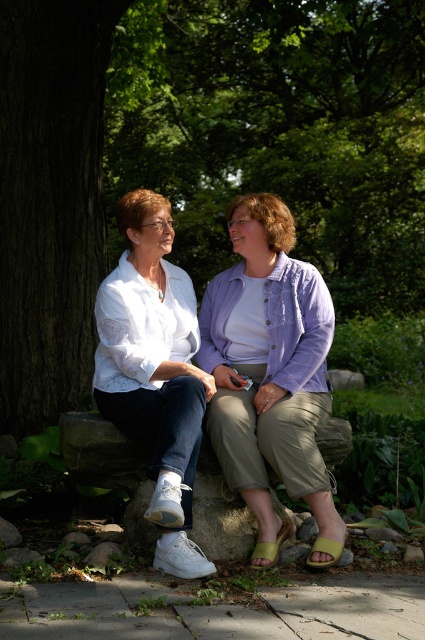
You are standing in a park and see the brown textured tree trunk at left. If you were to draw a straight line from your current position to the tree trunk, which direction would you face?

The brown textured tree trunk at left is located at coordinates point [195,156]. To draw a straight line to it, you would face towards the left direction.

You are a photographer aiming to capture a portrait of the two people sitting on the stone bench in the park. You want to ensure the white cotton shirt at center is perfectly centered in the frame. Given its coordinates at point 0.586, 0.631, should you adjust the camera to the left or right to center it?

The white cotton shirt at center is already positioned at coordinates (x=268, y=374). Since the center of the frame is typically at (x=212, y=320), the shirt is slightly to the right and above the exact center. To center it, you should adjust the camera slightly to the left and downward.